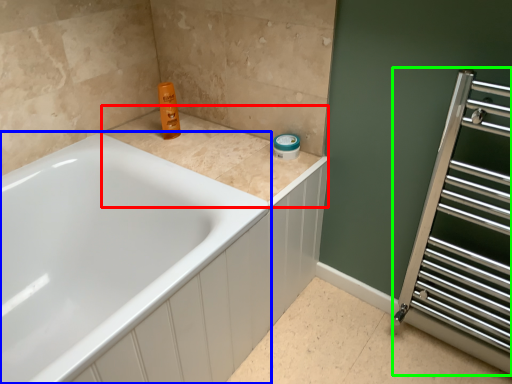
Question: Which object is the closest to the counter top (highlighted by a red box)? Choose among these: bathtub (highlighted by a blue box) or screen door (highlighted by a green box).

Choices:
 (A) bathtub
 (B) screen door

Answer: (A)